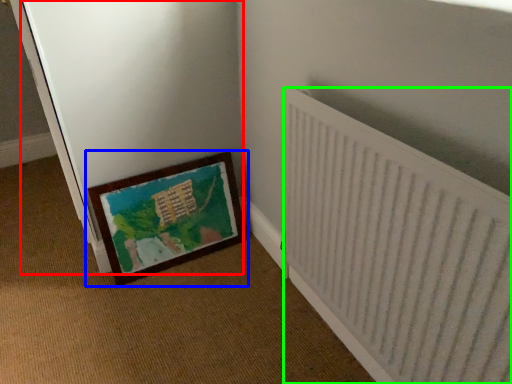
Question: Estimate the real-world distances between objects in this image. Which object is closer to screen door (highlighted by a red box), picture frame (highlighted by a blue box) or radiator (highlighted by a green box)?

Choices:
 (A) picture frame
 (B) radiator

Answer: (A)